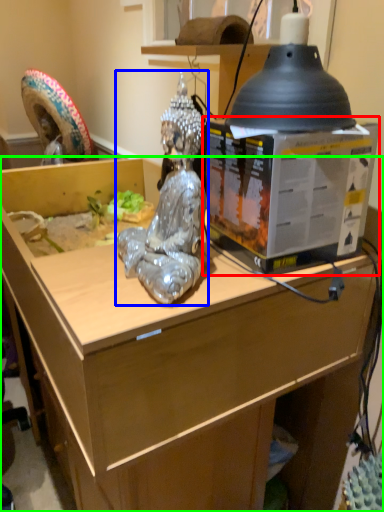
Question: Estimate the real-world distances between objects in this image. Which object is closer to box (highlighted by a red box), person (highlighted by a blue box) or desk (highlighted by a green box)?

Choices:
 (A) person
 (B) desk

Answer: (A)